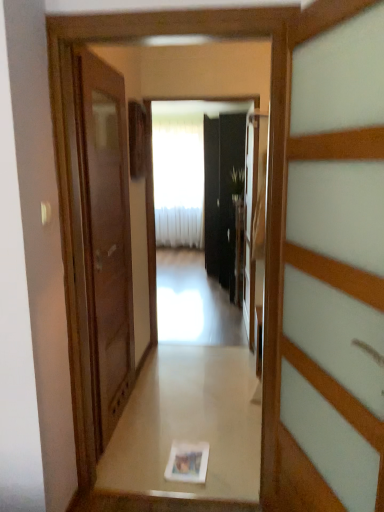
Describe the element at coordinates (237, 183) in the screenshot. I see `green leafy plant at center` at that location.

The height and width of the screenshot is (512, 384). Describe the element at coordinates (187, 462) in the screenshot. I see `white glossy photo frame at center` at that location.

I want to click on white glossy photo frame at center, so click(187, 462).

The height and width of the screenshot is (512, 384). Identify the location of black glass screen door at center. (221, 193).

Find the location of a particular element. white sheer curtain at center is located at coordinates (178, 180).

Based on the photo, can you tell me how much black glass screen door at center and matte brown door at left, which is the 2th door in front-to-back order, differ in facing direction?

The facing directions of black glass screen door at center and matte brown door at left, which is the 2th door in front-to-back order, are 179 degrees apart.

Find the location of a particular element. door that is the 2nd object to the left of the black glass screen door at center, starting at the anchor is located at coordinates (106, 236).

Is point (204, 220) closer or farther from the camera than point (96, 172)?

Point (204, 220) is positioned farther from the camera compared to point (96, 172).

Looking at this image, between black glass screen door at center and matte brown door at left, which is the 2th door in front-to-back order, which one has more height?

With more height is black glass screen door at center.

Is white sheer curtain at center facing towards glossy black mirror at center?

Yes, white sheer curtain at center is facing glossy black mirror at center.

Which is correct: white sheer curtain at center is inside glossy black mirror at center, or outside of it?

white sheer curtain at center is not enclosed by glossy black mirror at center.

Who is taller, white sheer curtain at center or glossy black mirror at center?

Standing taller between the two is white sheer curtain at center.

Considering the sizes of objects white glossy photo frame at center and black glass screen door at center in the image provided, who is taller, white glossy photo frame at center or black glass screen door at center?

With more height is black glass screen door at center.

Which is in front, white glossy photo frame at center or black glass screen door at center?

white glossy photo frame at center is closer to the camera.

Based on the photo, is white glossy photo frame at center positioned beyond the bounds of black glass screen door at center?

That's correct, white glossy photo frame at center is outside of black glass screen door at center.

Do you think black glass screen door at center is within wooden door at right, acting as the first door starting from the front, or outside of it?

black glass screen door at center is spatially situated outside wooden door at right, acting as the first door starting from the front.

Is black glass screen door at center facing away from wooden door at right, acting as the first door starting from the front?

No, black glass screen door at center is not facing away from wooden door at right, acting as the first door starting from the front.

Where is `mirror behind the white glossy photo frame at center`? The width and height of the screenshot is (384, 512). mirror behind the white glossy photo frame at center is located at coordinates (205, 187).

From the image's perspective, would you say white glossy photo frame at center is positioned over glossy black mirror at center?

No.

Which of these two, white glossy photo frame at center or glossy black mirror at center, is wider?

With larger width is white glossy photo frame at center.

From the image's perspective, would you say matte brown door at left, which is the 2th door in front-to-back order, is positioned over glossy black mirror at center?

Incorrect, from the image's perspective, matte brown door at left, which is the 2th door in front-to-back order, is lower than glossy black mirror at center.

Can you confirm if matte brown door at left, which is the 2th door in front-to-back order, is positioned to the right of glossy black mirror at center?

No.

Who is smaller, matte brown door at left, which ranks as the second door in right-to-left order, or glossy black mirror at center?

Smaller between the two is glossy black mirror at center.

Are matte brown door at left, the 1th door when ordered from left to right, and glossy black mirror at center making contact?

No, matte brown door at left, the 1th door when ordered from left to right, is not with glossy black mirror at center.

Which object is closer to the camera taking this photo, black glass screen door at center or green leafy plant at center?

green leafy plant at center is more forward.

In terms of height, does black glass screen door at center look taller or shorter compared to green leafy plant at center?

Clearly, black glass screen door at center is taller compared to green leafy plant at center.

Is point (230, 194) more distant than point (236, 170)?

Yes, it is behind point (236, 170).

Based on the photo, considering the relative positions of black glass screen door at center and green leafy plant at center in the image provided, is black glass screen door at center to the left or to the right of green leafy plant at center?

black glass screen door at center is to the right of green leafy plant at center.

I want to click on screen door on the right of the matte brown door at left, arranged as the 1th door when viewed from the back, so click(x=221, y=193).

Identify the location of mirror located underneath the white sheer curtain at center (from a real-world perspective). (205, 187).

When comparing their distances from matte brown door at left, the 1th door when ordered from left to right, does glossy black mirror at center or white glossy photo frame at center seem further?

glossy black mirror at center.

Which object lies nearer to the anchor point white sheer curtain at center, wooden door at right, acting as the first door starting from the front, or white glossy photo frame at center?

The object closer to white sheer curtain at center is white glossy photo frame at center.

When comparing their distances from wooden door at right, acting as the 2th door starting from the left, does green leafy plant at center or black glass screen door at center seem further?

black glass screen door at center lies further to wooden door at right, acting as the 2th door starting from the left, than the other object.

Considering their positions, is green leafy plant at center positioned further to black glass screen door at center than wooden door at right, acting as the first door starting from the front?

wooden door at right, acting as the first door starting from the front.

Considering their positions, is glossy black mirror at center positioned closer to black glass screen door at center than white sheer curtain at center?

glossy black mirror at center is positioned closer to the anchor black glass screen door at center.

From the image, which object appears to be farther from white sheer curtain at center, matte brown door at left, arranged as the 1th door when viewed from the back, or wooden door at right, acting as the 2th door starting from the left?

wooden door at right, acting as the 2th door starting from the left, lies further to white sheer curtain at center than the other object.

In the scene shown: Which object lies further to the anchor point white glossy photo frame at center, black glass screen door at center or white sheer curtain at center?

The object further to white glossy photo frame at center is white sheer curtain at center.

When comparing their distances from wooden door at right, the 1th door viewed from the right, does green leafy plant at center or white glossy photo frame at center seem further?

green leafy plant at center.

The height and width of the screenshot is (512, 384). What are the coordinates of `mirror located between white glossy photo frame at center and green leafy plant at center in the depth direction` in the screenshot? It's located at (205, 187).

Where is `mirror between white glossy photo frame at center and white sheer curtain at center in the front-back direction`? The width and height of the screenshot is (384, 512). mirror between white glossy photo frame at center and white sheer curtain at center in the front-back direction is located at coordinates (205, 187).

Locate an element on the screen. door between wooden door at right, which ranks as the 2th door in back-to-front order, and white sheer curtain at center from front to back is located at coordinates (106, 236).

Locate an element on the screen. Image resolution: width=384 pixels, height=512 pixels. screen door between green leafy plant at center and white sheer curtain at center from front to back is located at coordinates (221, 193).